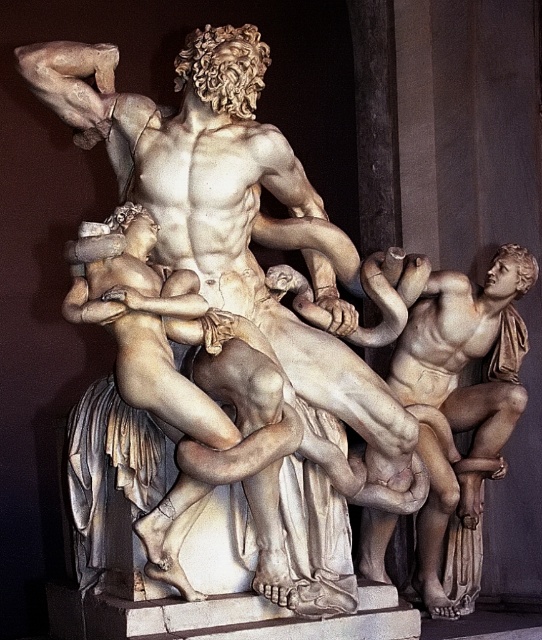
You are an art conservator examining the sculpture. You notice two points on the sculpture marked at coordinates point [100,550] and point [454,374]. Which point is positioned closer to your viewpoint?

Point [100,550] is closer to the viewer than point [454,374].

You are an art student analyzing the spatial arrangement of the sculptures in the image. Which sculpture is positioned to the left when comparing the white marble sculpture at center and the matte bronze statue at right?

The white marble sculpture at center is positioned to the left of the matte bronze statue at right.